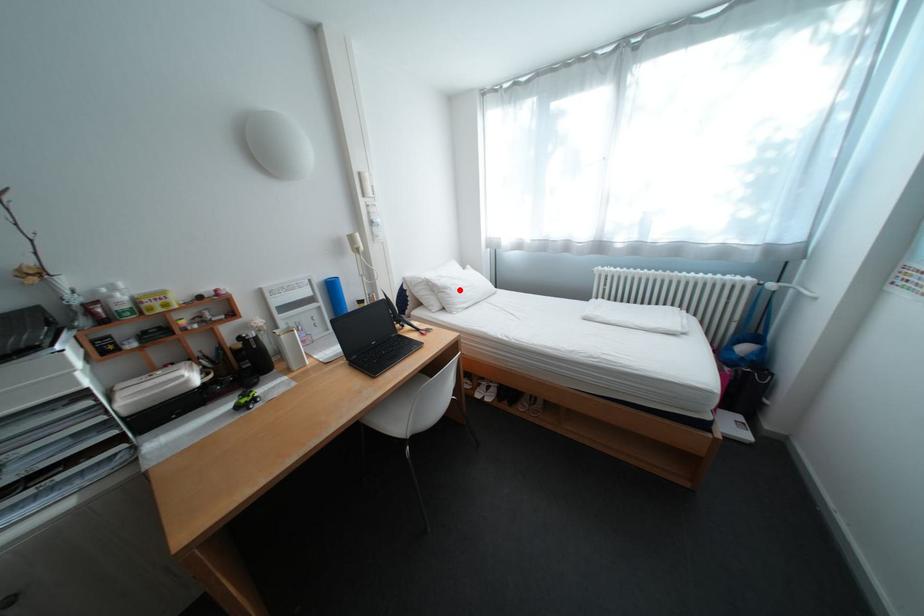
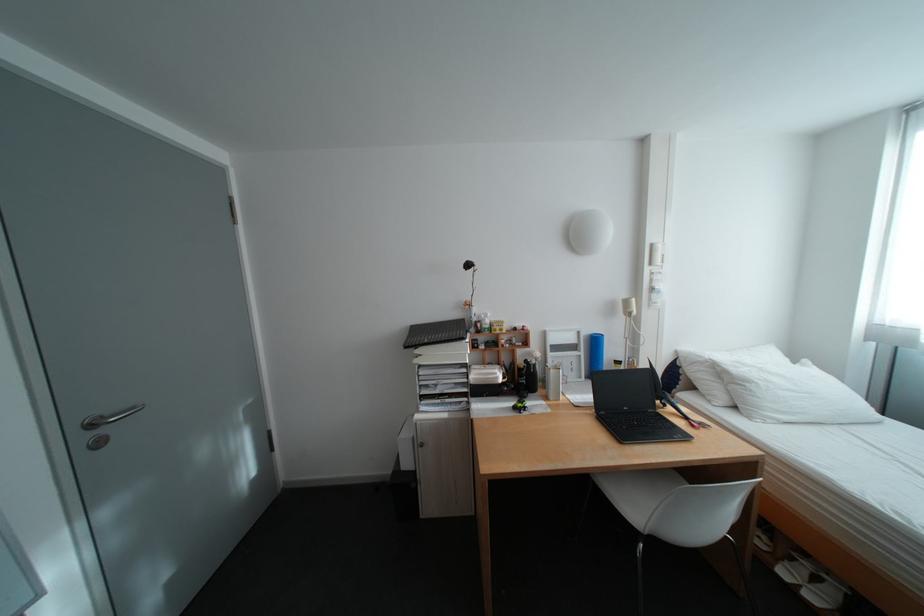
Locate, in the second image, the point that corresponds to the highlighted location in the first image.

(761, 384)